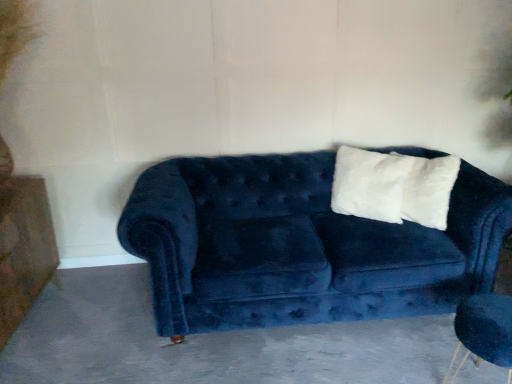
Question: Is dark gray concrete at center taller or shorter than white fluffy pillow at upper right?

Choices:
 (A) tall
 (B) short

Answer: (B)

Question: From a real-world perspective, is dark gray concrete at center physically located above or below white fluffy pillow at upper right?

Choices:
 (A) above
 (B) below

Answer: (B)

Question: Which is farther from the velvet blue couch at center?

Choices:
 (A) velvet blue armchair at lower right
 (B) white fluffy pillow at upper right
 (C) dark gray concrete at center

Answer: (A)

Question: Estimate the real-world distances between objects in this image. Which object is farther from the velvet blue couch at center?

Choices:
 (A) dark gray concrete at center
 (B) velvet blue armchair at lower right
 (C) white fluffy pillow at upper right

Answer: (B)